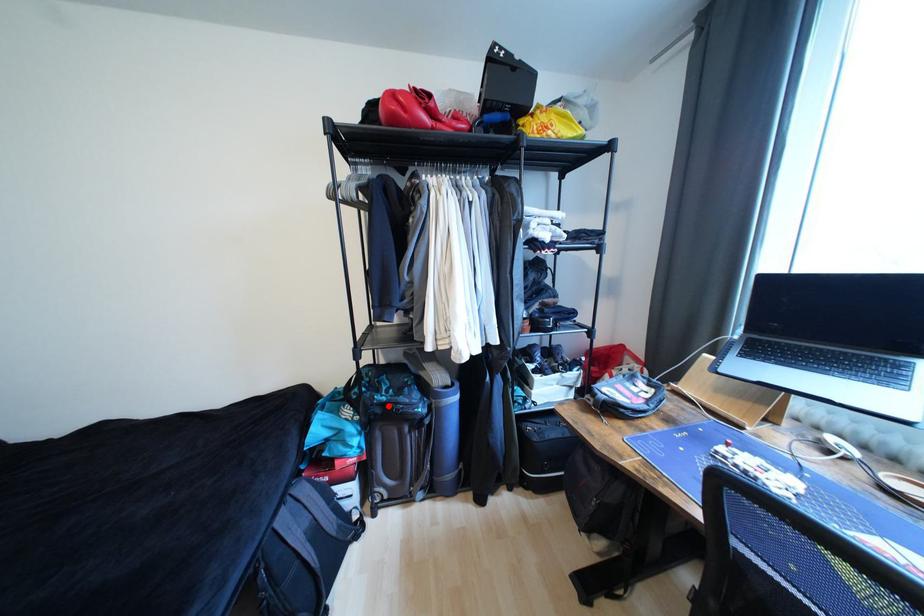
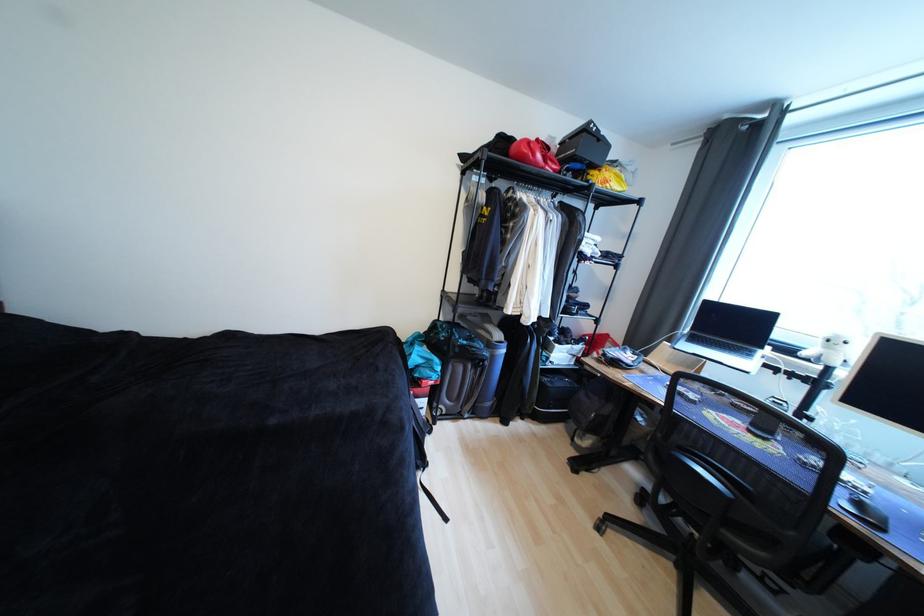
Locate, in the second image, the point that corresponds to the highlighted location in the first image.

(469, 347)